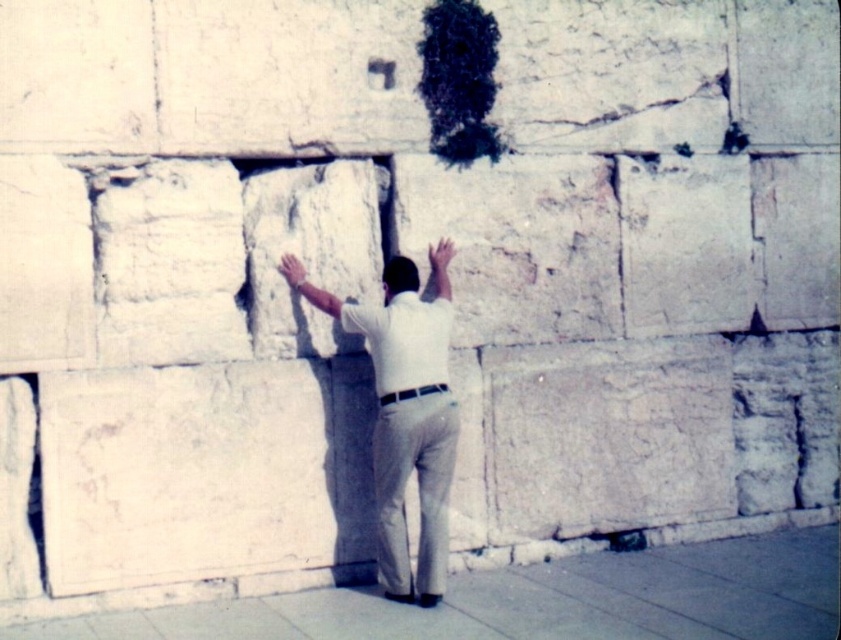
Measure the distance between white stone man at center and white cotton shirt at center.

white stone man at center is 4.91 inches away from white cotton shirt at center.

You are a GUI agent. You are given a task and a screenshot of the screen. Output one action in this format:
    pyautogui.click(x=<x>, y=<y>)
    Task: Click on the white stone man at center
    Image resolution: width=841 pixels, height=640 pixels.
    Given the screenshot: What is the action you would take?
    pyautogui.click(x=405, y=412)